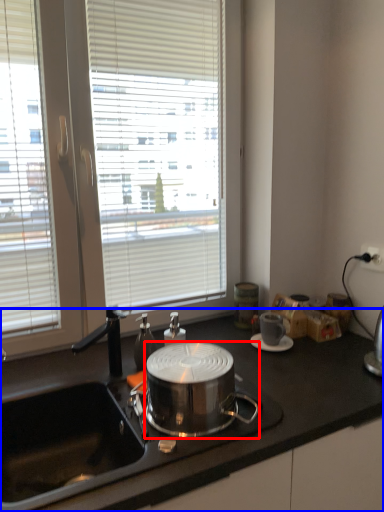
Question: Among these objects, which one is nearest to the camera, kitchen appliance (highlighted by a red box) or countertop (highlighted by a blue box)?

Choices:
 (A) kitchen appliance
 (B) countertop

Answer: (B)